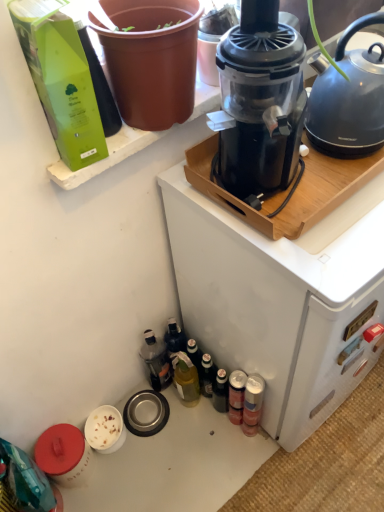
At what (x,y) coordinates should I click in order to perform the action: click on free space in front of green glass bottle at lower center, which is counted as the 3th bottle, starting from the right. Please return your answer as a coordinate pair (x, y). This screenshot has width=384, height=512. Looking at the image, I should click on point(195,448).